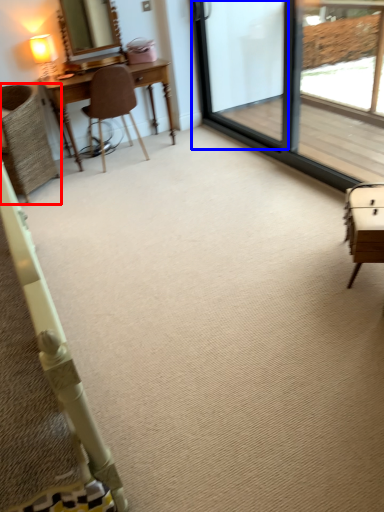
Question: Which object is further to the camera taking this photo, chair (highlighted by a red box) or screen door (highlighted by a blue box)?

Choices:
 (A) chair
 (B) screen door

Answer: (A)